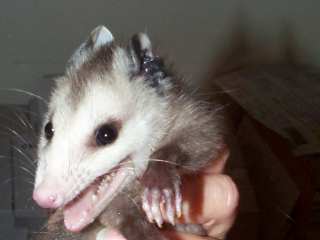
Where is `boxes in background`? This screenshot has width=320, height=240. boxes in background is located at coordinates (267, 175), (272, 103), (238, 177).